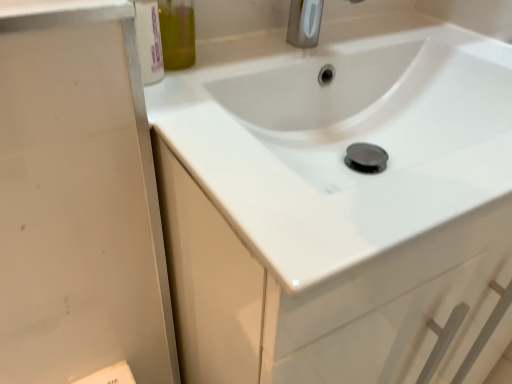
Where is `free point in front of olive green glass bottle at upper left`? The height and width of the screenshot is (384, 512). free point in front of olive green glass bottle at upper left is located at coordinates 188,106.